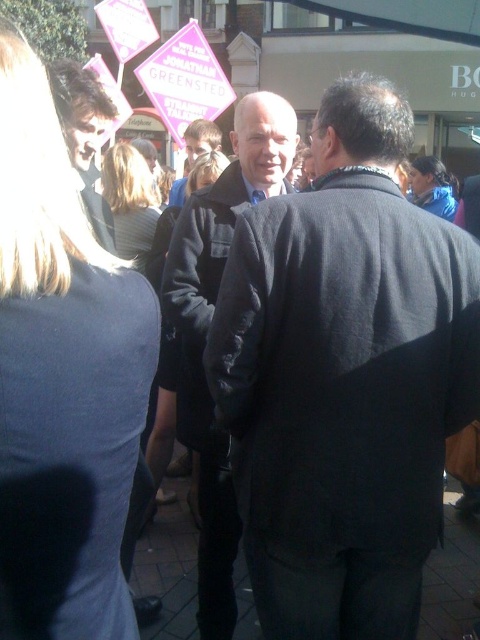
You are a photographer trying to capture a group photo of the two people in dark gray coat at center and matte black coat at center. Since you want to ensure both are fully visible, which coat should you focus on to adjust the framing so that the shorter one isn not cropped?

The dark gray coat at center is shorter than the matte black coat at center. Therefore, you should focus on the dark gray coat at center to adjust the framing so that the shorter one is not cropped.

You are a photographer trying to capture a group photo of the people in the scene. You notice the dark brown hair at upper left and the smooth black jacket at center. Which of these two elements has a smaller width in the image?

The dark brown hair at upper left has a smaller width than the smooth black jacket at center.